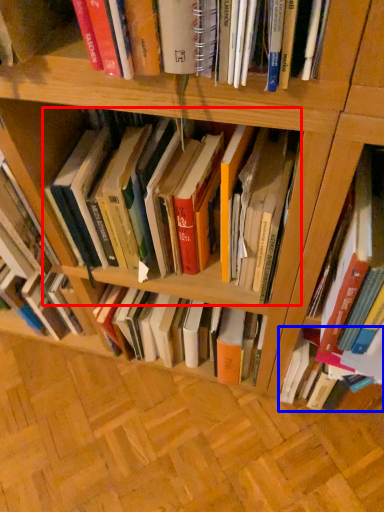
Question: Which point is closer to the camera, book (highlighted by a red box) or book (highlighted by a blue box)?

Choices:
 (A) book
 (B) book

Answer: (A)